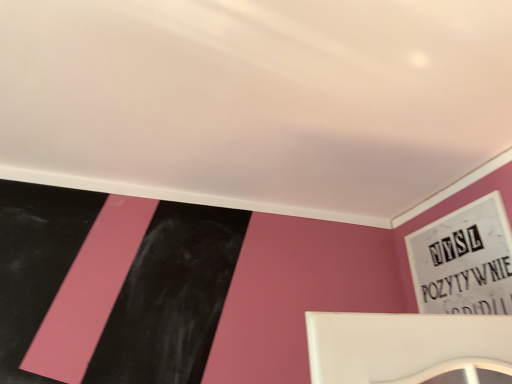
Locate an element on the screen. white marble sign at upper right is located at coordinates (464, 261).

What do you see at coordinates (464, 261) in the screenshot? The image size is (512, 384). I see `white marble sign at upper right` at bounding box center [464, 261].

Identify the location of white marble sign at upper right. (464, 261).